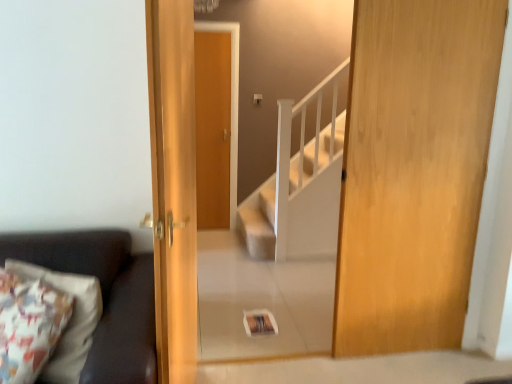
Question: Does dark brown leather couch at left turn towards wooden door at center, which is the first door from left to right?

Choices:
 (A) yes
 (B) no

Answer: (B)

Question: From a real-world perspective, is dark brown leather couch at left physically below wooden door at center, which is the first door from left to right?

Choices:
 (A) no
 (B) yes

Answer: (B)

Question: From the image's perspective, would you say dark brown leather couch at left is positioned over wooden door at center, which is the first door from left to right?

Choices:
 (A) no
 (B) yes

Answer: (A)

Question: Is dark brown leather couch at left positioned in front of wooden door at center, acting as the 2th door starting from the right?

Choices:
 (A) no
 (B) yes

Answer: (B)

Question: Is dark brown leather couch at left smaller than wooden door at center, which is the first door from left to right?

Choices:
 (A) no
 (B) yes

Answer: (A)

Question: Can you see dark brown leather couch at left touching wooden door at center, acting as the 2th door starting from the right?

Choices:
 (A) no
 (B) yes

Answer: (A)

Question: From the image's perspective, does wooden door at right, positioned as the first door in right-to-left order, appear higher than wooden door at center, which is the first door from left to right?

Choices:
 (A) no
 (B) yes

Answer: (B)

Question: Is wooden door at center, acting as the 2th door starting from the right, surrounded by wooden door at right, positioned as the first door in right-to-left order?

Choices:
 (A) yes
 (B) no

Answer: (B)

Question: Is wooden door at right, which is counted as the second door, starting from the left, smaller than wooden door at center, which is the first door from left to right?

Choices:
 (A) yes
 (B) no

Answer: (A)

Question: Does wooden door at right, positioned as the first door in right-to-left order, have a larger size compared to wooden door at center, acting as the 2th door starting from the right?

Choices:
 (A) no
 (B) yes

Answer: (A)

Question: Is wooden door at right, which is counted as the second door, starting from the left, shorter than wooden door at center, which is the first door from left to right?

Choices:
 (A) no
 (B) yes

Answer: (A)

Question: Is wooden door at right, which is counted as the second door, starting from the left, thinner than wooden door at center, acting as the 2th door starting from the right?

Choices:
 (A) no
 (B) yes

Answer: (B)

Question: Is dark brown leather couch at left closer to the viewer compared to wooden door at right, which is counted as the second door, starting from the left?

Choices:
 (A) no
 (B) yes

Answer: (B)